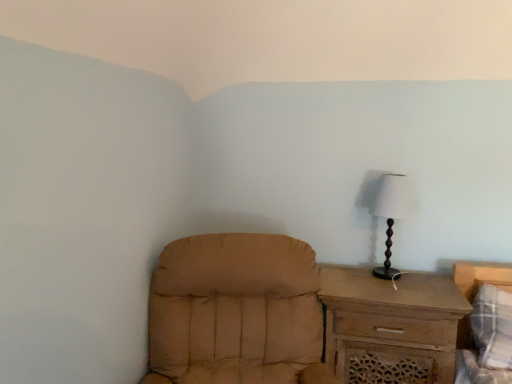
Question: From a real-world perspective, is tan fabric chair at lower left positioned above or below plaid fabric bed at lower right?

Choices:
 (A) below
 (B) above

Answer: (B)

Question: From their relative heights in the image, would you say tan fabric chair at lower left is taller or shorter than plaid fabric bed at lower right?

Choices:
 (A) tall
 (B) short

Answer: (A)

Question: Which object is positioned farthest from the white fabric lampshade at right?

Choices:
 (A) tan fabric chair at lower left
 (B) brown wooden chest of drawers at right
 (C) plaid fabric bed at lower right

Answer: (A)

Question: Which of these objects is positioned closest to the brown wooden chest of drawers at right?

Choices:
 (A) white fabric lampshade at right
 (B) plaid fabric bed at lower right
 (C) tan fabric chair at lower left

Answer: (B)